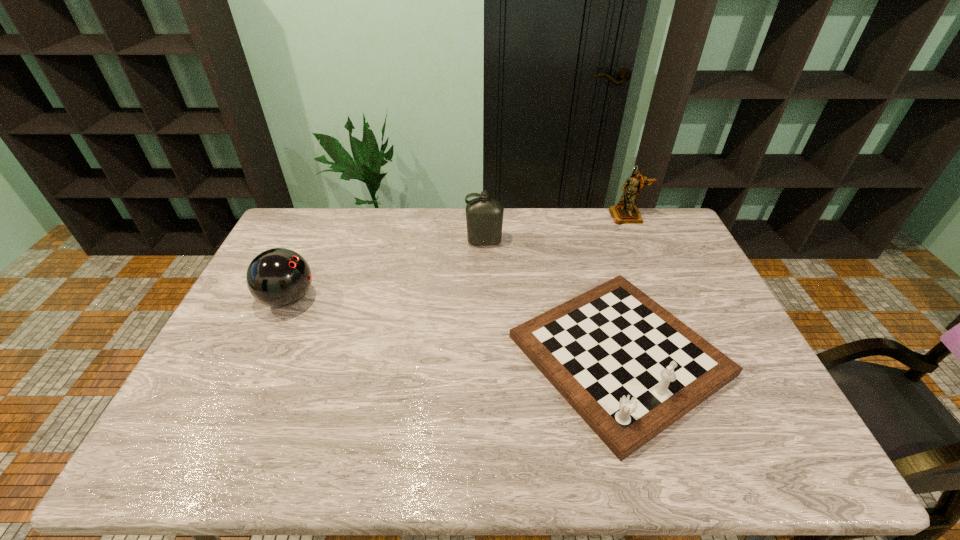
Identify the location of vacant space that is in between the farthest object and the bowling ball. This screenshot has width=960, height=540. 458,258.

Identify which object is the third nearest to the farthest object. Please provide its 2D coordinates. Your answer should be formatted as a tuple, i.e. [(x, y)], where the tuple contains the x and y coordinates of a point satisfying the conditions above.

[(278, 277)]

Select which object appears as the second closest to the bowling ball. Please provide its 2D coordinates. Your answer should be formatted as a tuple, i.e. [(x, y)], where the tuple contains the x and y coordinates of a point satisfying the conditions above.

[(630, 369)]

You are a GUI agent. You are given a task and a screenshot of the screen. Output one action in this format:
    pyautogui.click(x=<x>, y=<y>)
    Task: Click on the free space that satisfies the following two spatial constraints: 1. on the surface of the third tallest object near the finger holes; 2. on the right side of the shortest object
    
    Given the screenshot: What is the action you would take?
    [x=263, y=355]

Locate an element on the screen. Image resolution: width=960 pixels, height=540 pixels. vacant area in the image that satisfies the following two spatial constraints: 1. on the front-facing side of the figurine; 2. on the surface of the bowling ball near the finger holes is located at coordinates (663, 299).